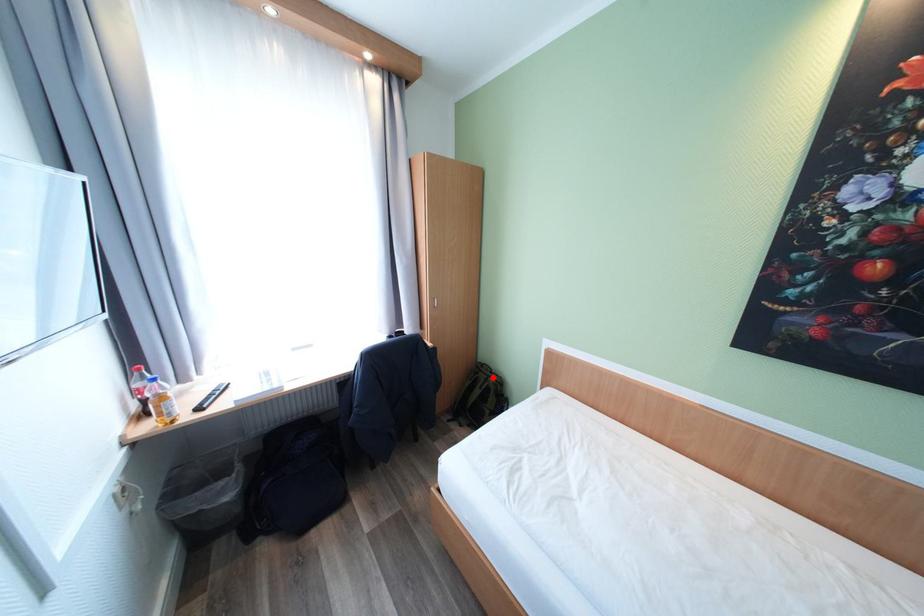
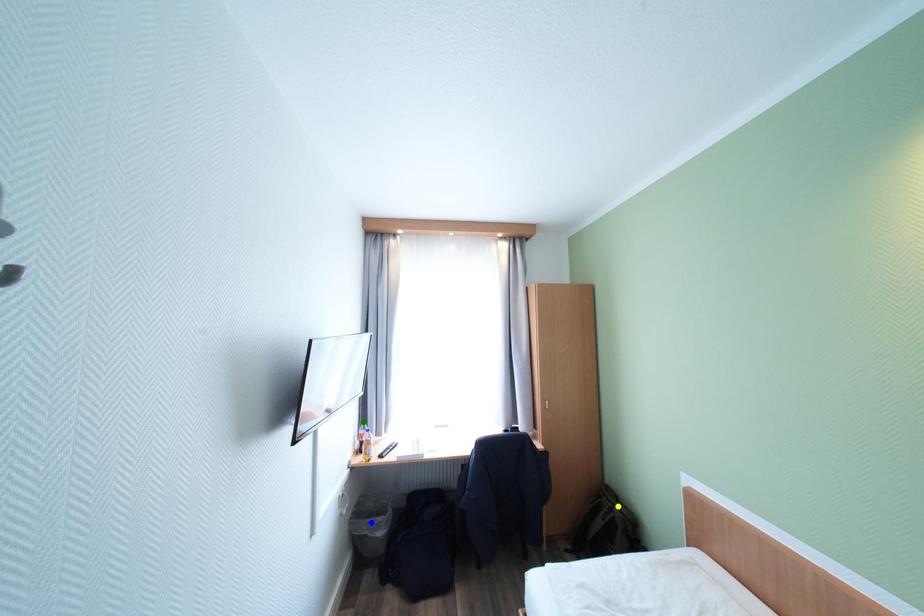
Question: I am providing you with two images of the same scene from different viewpoints. A red point is marked on the first image. You are given multiple points on the second image. Which spot in image 2 lines up with the point in image 1?

Choices:
 (A) blue point
 (B) yellow point
 (C) green point

Answer: (B)